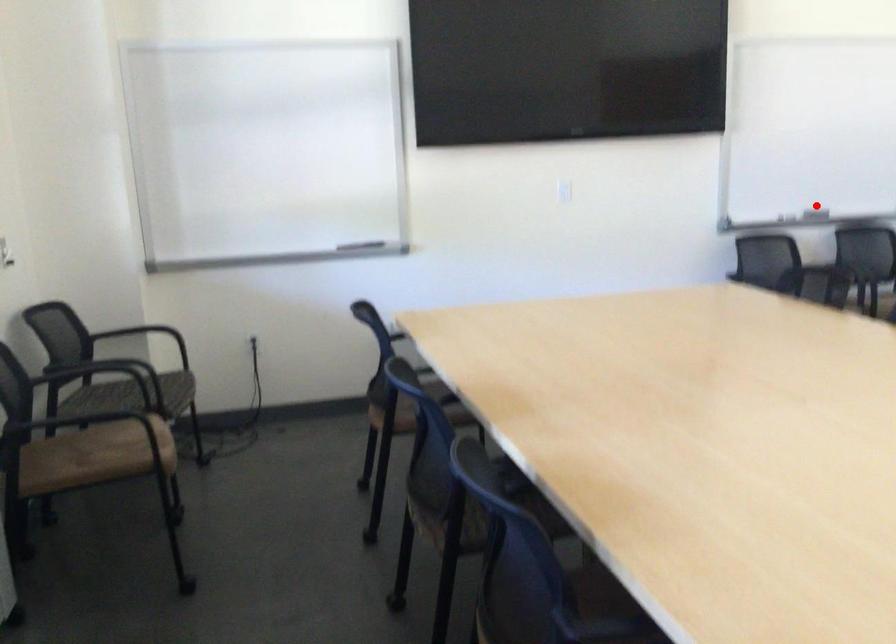
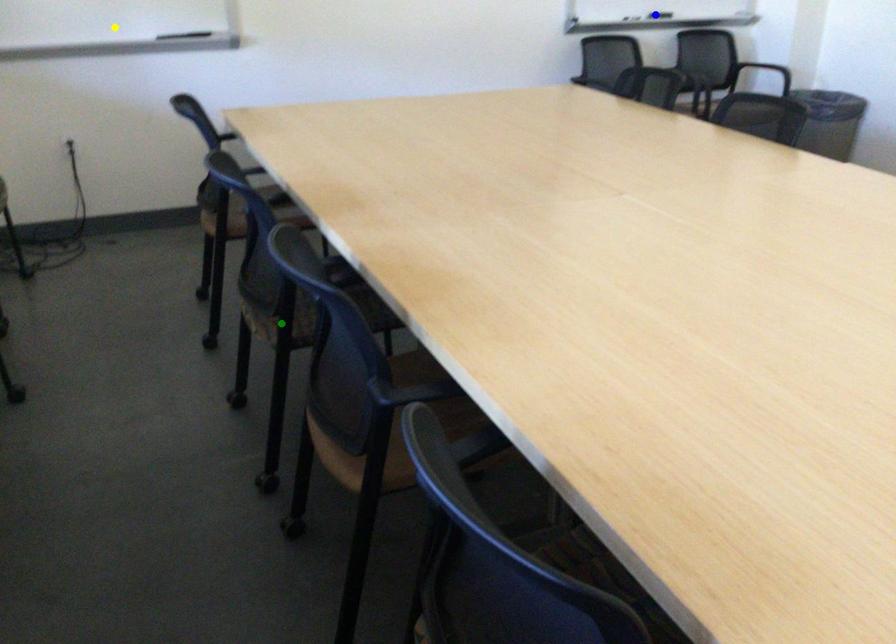
Question: I am providing you with two images of the same scene from different viewpoints. A red point is marked on the first image. You are given multiple points on the second image. Which point in image 2 represents the same 3d spot as the red point in image 1?

Choices:
 (A) green point
 (B) yellow point
 (C) blue point

Answer: (C)